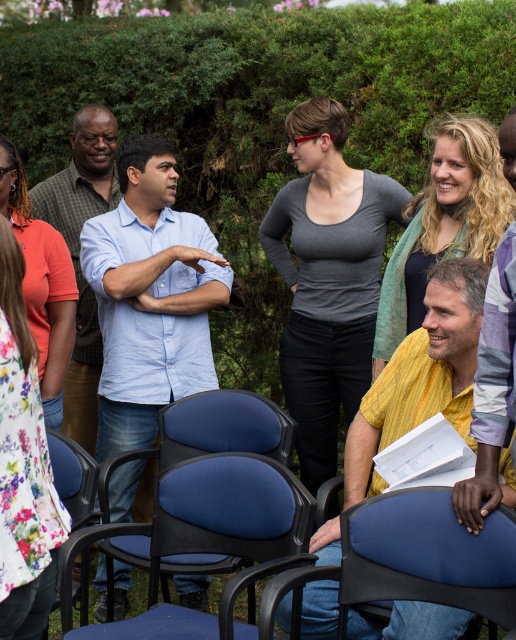
Question: Estimate the real-world distances between objects in this image. Which object is farther from the floral fabric shirt at left?

Choices:
 (A) blue fabric chair at lower left
 (B) light blue button-down shirt at center
 (C) blonde hair scarf at upper right

Answer: (C)

Question: Which object is farther from the camera taking this photo?

Choices:
 (A) blue fabric chair at lower center
 (B) yellow woven scarf at center
 (C) matte orange shirt at left
 (D) light blue button-down shirt at center

Answer: (D)

Question: Can you confirm if blue fabric chair at center is positioned below light blue shirt at center?

Choices:
 (A) yes
 (B) no

Answer: (A)

Question: Considering the relative positions of yellow woven scarf at center and blue fabric chair at center in the image provided, where is yellow woven scarf at center located with respect to blue fabric chair at center?

Choices:
 (A) below
 (B) above

Answer: (B)

Question: Which of these objects is positioned farthest from the gray matte shirt at center?

Choices:
 (A) green leafy hedge at upper center
 (B) yellow woven scarf at center

Answer: (B)

Question: Does light blue button-down shirt at center appear on the right side of matte orange shirt at left?

Choices:
 (A) yes
 (B) no

Answer: (A)